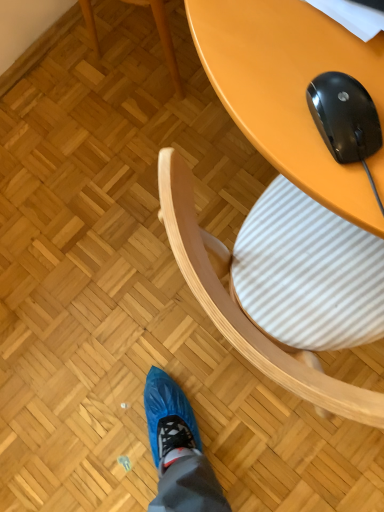
This screenshot has height=512, width=384. I want to click on free point to the left of black glossy mouse at upper right, so click(278, 131).